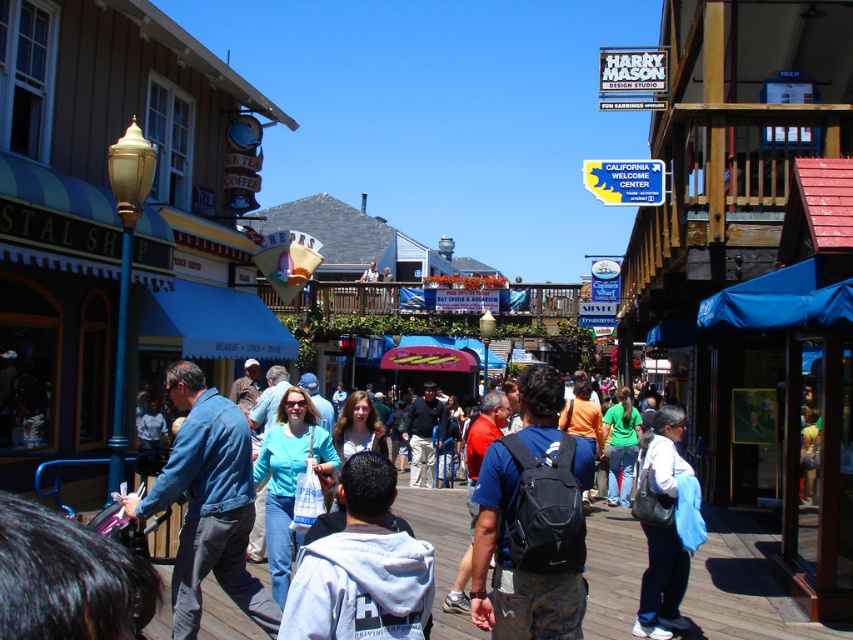
Based on the photo, can you confirm if denim jacket at center is positioned above white cotton shirt at center?

Actually, denim jacket at center is below white cotton shirt at center.

Which is in front, point (459, 637) or point (650, 522)?

Point (459, 637) is in front.

Measure the distance between denim jacket at center and camera.

The distance of denim jacket at center from camera is 12.11 meters.

I want to click on denim jacket at center, so pyautogui.click(x=613, y=570).

Is denim jacket at lower left positioned behind denim jacket at center?

No, denim jacket at lower left is closer to the viewer.

Does denim jacket at lower left appear under denim jacket at center?

Actually, denim jacket at lower left is above denim jacket at center.

I want to click on denim jacket at lower left, so click(207, 502).

Where is `denim jacket at lower left`? The width and height of the screenshot is (853, 640). denim jacket at lower left is located at coordinates (207, 502).

At what (x,y) coordinates should I click in order to perform the action: click on denim jacket at lower left. Please return your answer as a coordinate pair (x, y). Looking at the image, I should click on (207, 502).

Is point (242, 481) more distant than point (662, 529)?

No.

The height and width of the screenshot is (640, 853). Find the location of `denim jacket at lower left`. denim jacket at lower left is located at coordinates (207, 502).